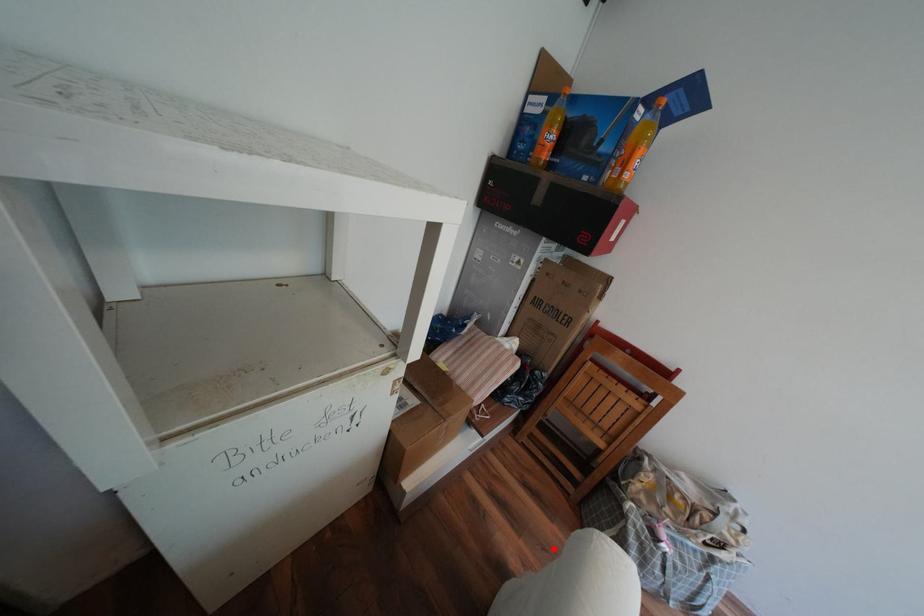
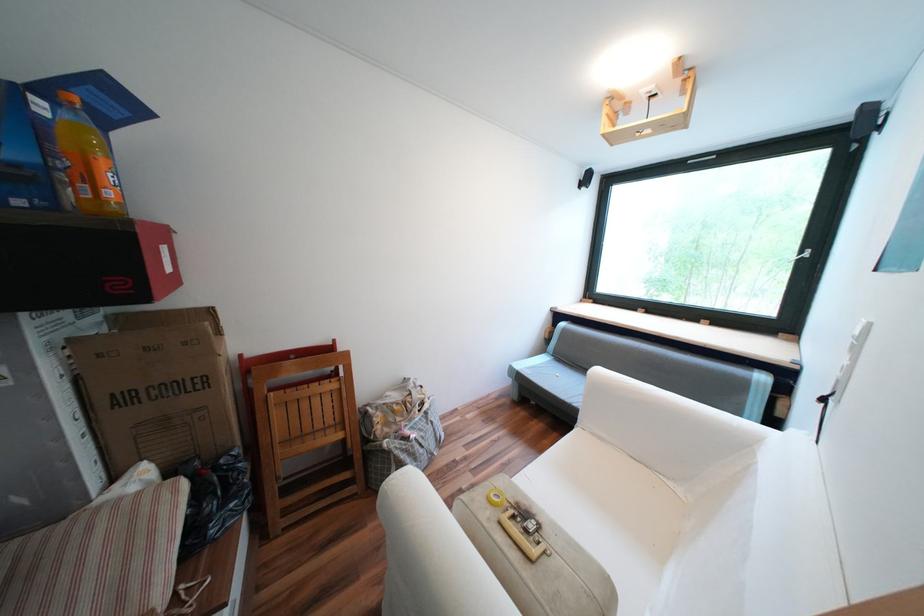
Question: I am providing you with two images of the same scene from different viewpoints. In image1, a red point is highlighted. Considering the same 3D point in image2, which of the following is correct?

Choices:
 (A) It is closer
 (B) It is farther

Answer: (B)